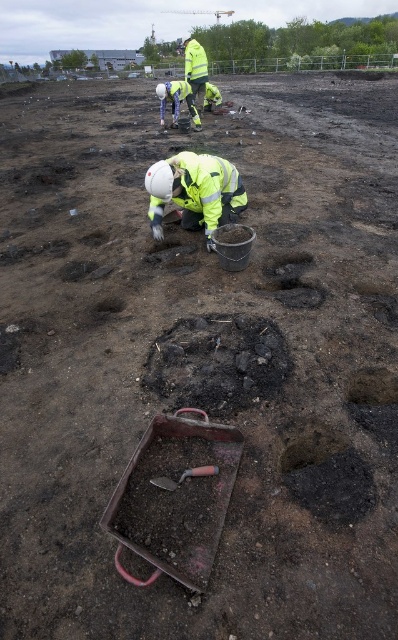
Does high visibility yellow jacket at center appear on the right side of metallic shovel at center?

Indeed, high visibility yellow jacket at center is positioned on the right side of metallic shovel at center.

Is high visibility yellow jacket at center smaller than metallic shovel at center?

Actually, high visibility yellow jacket at center might be larger than metallic shovel at center.

The image size is (398, 640). Find the location of `high visibility yellow jacket at center`. high visibility yellow jacket at center is located at coordinates (195, 193).

Looking at this image, who is taller, reflective yellow safety vest at upper center or metallic shovel at center?

reflective yellow safety vest at upper center is taller.

Who is positioned more to the left, reflective yellow safety vest at upper center or metallic shovel at center?

reflective yellow safety vest at upper center

Between point (183, 93) and point (163, 477), which one is positioned in front?

Point (163, 477) is more forward.

Locate an element on the screen. This screenshot has height=640, width=398. reflective yellow safety vest at upper center is located at coordinates (177, 100).

Does high visibility yellow jacket at center have a lesser width compared to reflective yellow safety vest at upper center?

Yes.

Is high visibility yellow jacket at center positioned at the back of reflective yellow safety vest at upper center?

No, high visibility yellow jacket at center is closer to the viewer.

The width and height of the screenshot is (398, 640). What do you see at coordinates (195, 193) in the screenshot?
I see `high visibility yellow jacket at center` at bounding box center [195, 193].

Locate an element on the screen. high visibility yellow jacket at center is located at coordinates (195, 193).